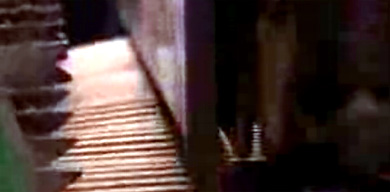
I want to click on wall, so click(x=150, y=23).